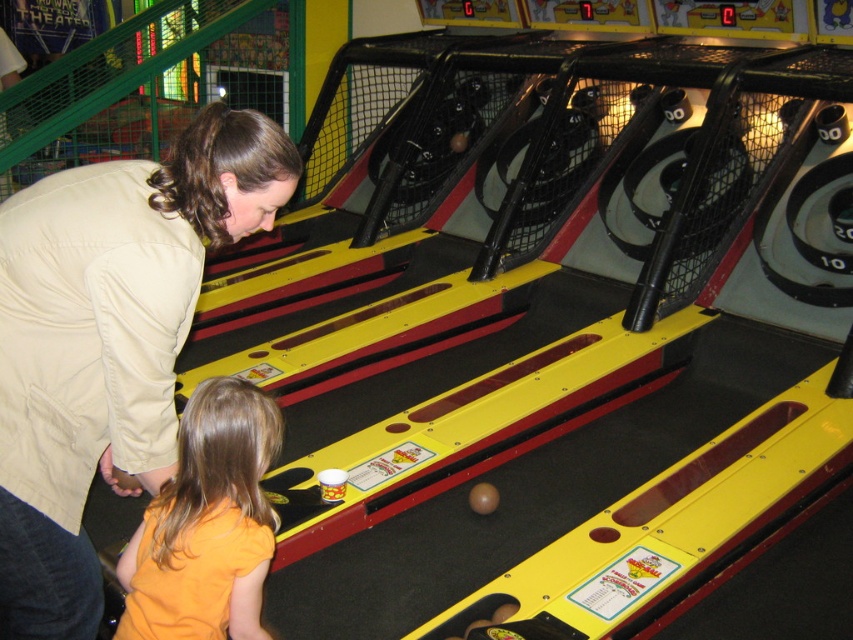
Is point (74, 481) positioned behind point (244, 556)?

No.

Can you confirm if beige fabric shirt at center is positioned to the left of orange cotton shirt at lower left?

Correct, you'll find beige fabric shirt at center to the left of orange cotton shirt at lower left.

Locate an element on the screen. The width and height of the screenshot is (853, 640). beige fabric shirt at center is located at coordinates (107, 340).